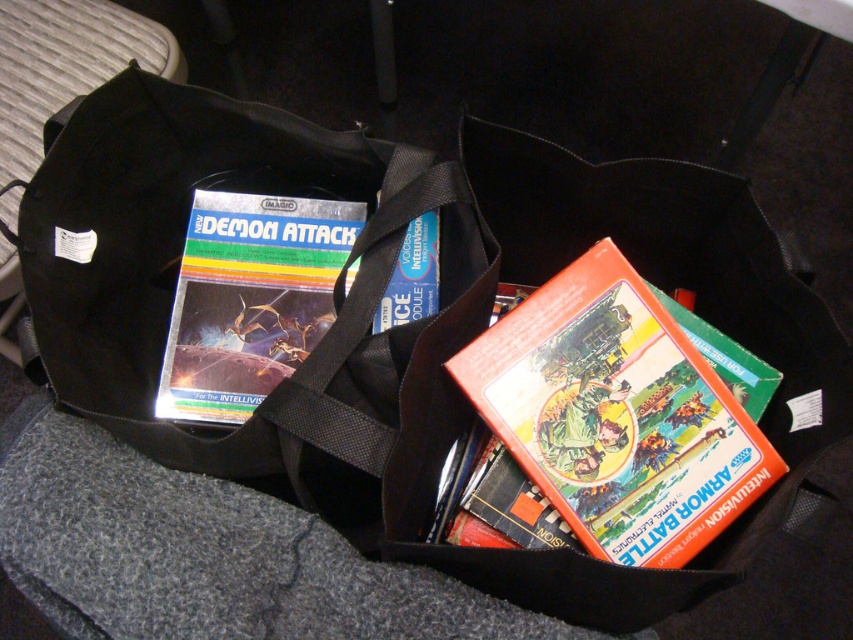
Question: From the image, what is the correct spatial relationship of orange matte game cartridge at center in relation to metallic silver game cartridge at center-left?

Choices:
 (A) right
 (B) left

Answer: (A)

Question: Is orange matte game cartridge at center to the left of metallic silver game cartridge at center-left from the viewer's perspective?

Choices:
 (A) no
 (B) yes

Answer: (A)

Question: Which object is closer to the camera taking this photo?

Choices:
 (A) orange matte game cartridge at center
 (B) metallic silver game cartridge at center-left

Answer: (A)

Question: Which object is closer to the camera taking this photo?

Choices:
 (A) orange matte game cartridge at center
 (B) metallic silver game cartridge at center-left

Answer: (A)

Question: Among these objects, which one is farthest from the camera?

Choices:
 (A) orange matte game cartridge at center
 (B) metallic silver game cartridge at center-left

Answer: (B)

Question: Is orange matte game cartridge at center thinner than metallic silver game cartridge at center-left?

Choices:
 (A) yes
 (B) no

Answer: (B)